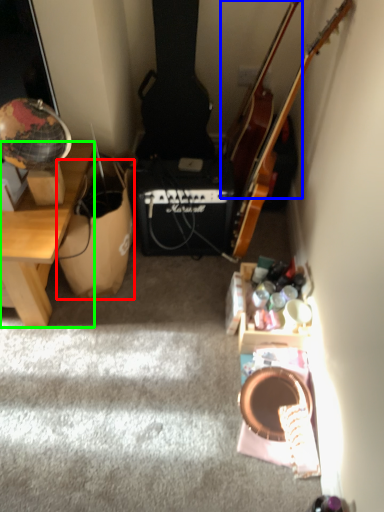
Question: Based on their relative distances, which object is farther from cardboard box (highlighted by a red box)? Choose from cello (highlighted by a blue box) and desk (highlighted by a green box).

Choices:
 (A) cello
 (B) desk

Answer: (A)